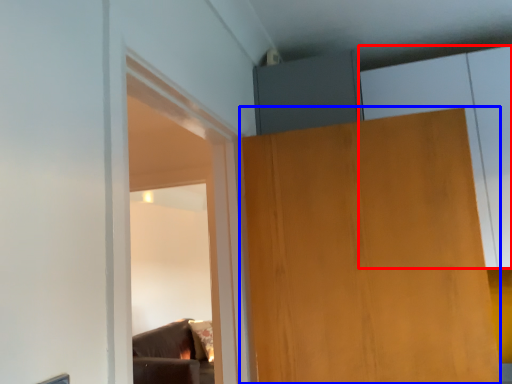
Question: Which object appears farthest to the camera in this image, cabinetry (highlighted by a red box) or door (highlighted by a blue box)?

Choices:
 (A) cabinetry
 (B) door

Answer: (A)